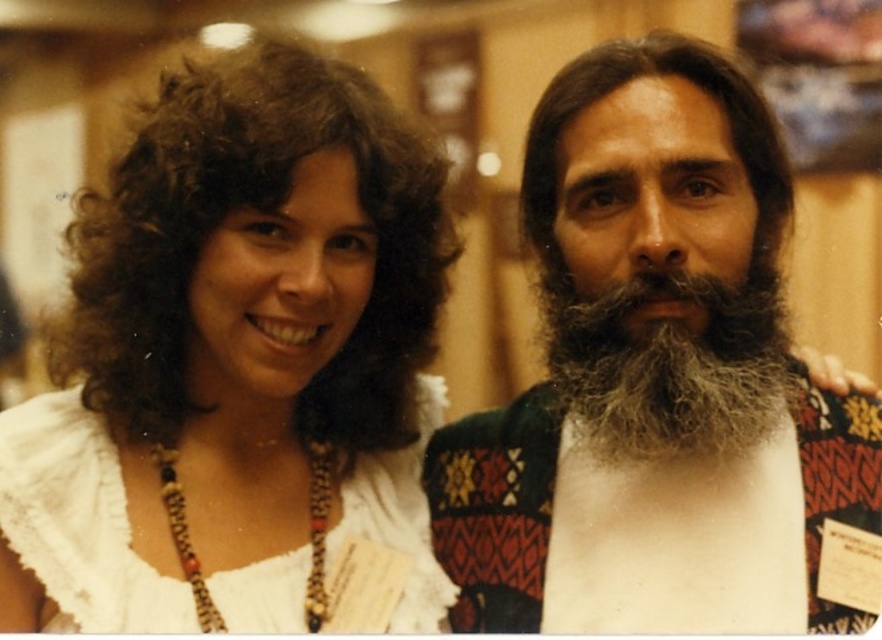
You are taking a photo of two people standing in a room. The dark curly hair at left and the beaded necklace at center are in the frame. Which object is nearer to the camera?

The dark curly hair at left is closer to the viewer than the beaded necklace at center, so it is nearer to the camera.

You are organizing a charity event and need to decide which item to donate based on size. You have a white lace dress at center and a beaded necklace at center. Which item should you choose if you want to donate the larger one?

The white lace dress at center is bigger than the beaded necklace at center, so you should choose the white lace dress at center for donation if you want the larger item.